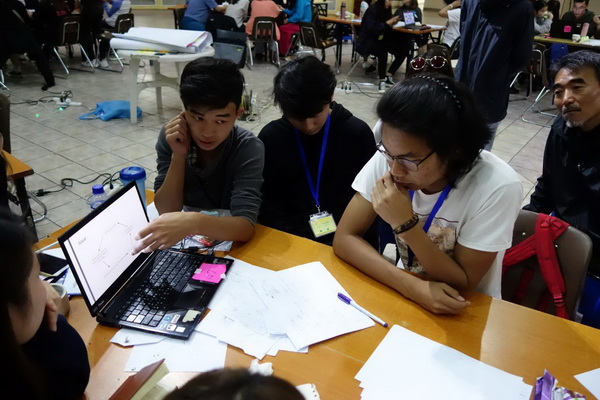
The width and height of the screenshot is (600, 400). Identify the location of pen. (371, 308).